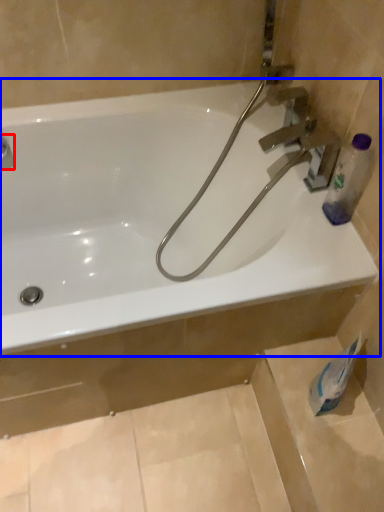
Question: Which point is further to the camera, plumbing fixture (highlighted by a red box) or bathtub (highlighted by a blue box)?

Choices:
 (A) plumbing fixture
 (B) bathtub

Answer: (A)